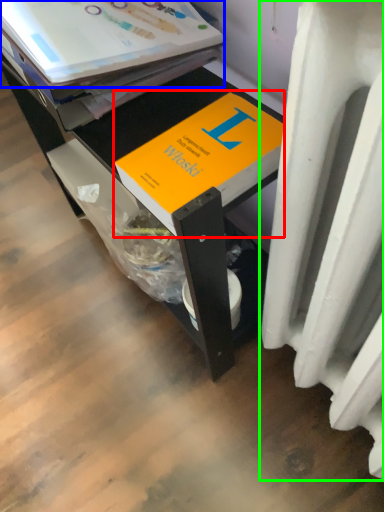
Question: Which object is positioned closest to book (highlighted by a red box)? Select from paperback book (highlighted by a blue box) and heater (highlighted by a green box).

Choices:
 (A) paperback book
 (B) heater

Answer: (A)